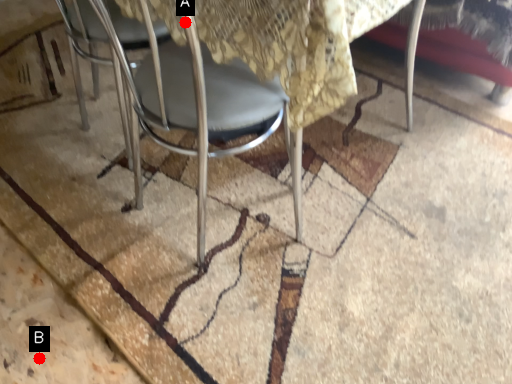
Question: Two points are circled on the image, labeled by A and B beside each circle. Which point is closer to the camera?

Choices:
 (A) A is closer
 (B) B is closer

Answer: (A)